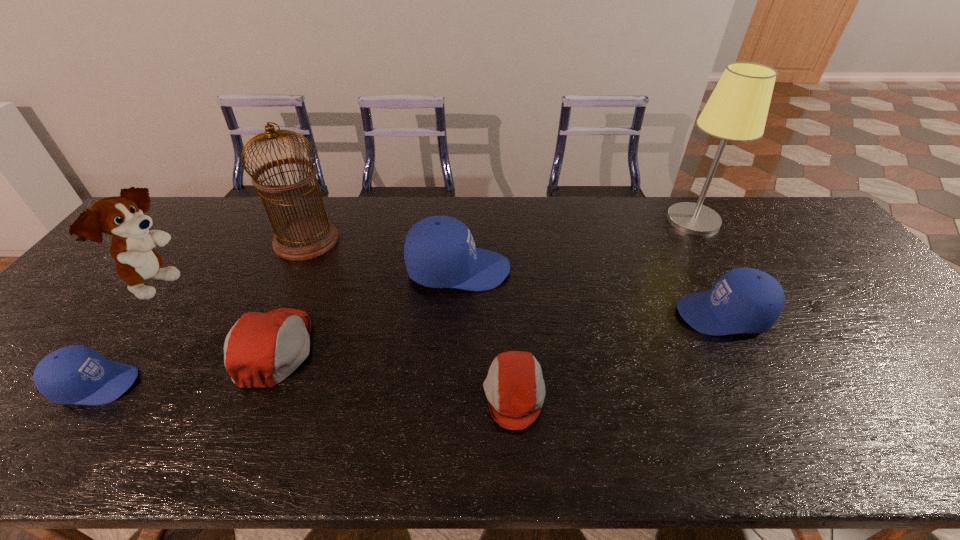
At what (x,y) coordinates should I click in order to perform the action: click on free space between the table lamp and the smallest blue cap. Please return your answer as a coordinate pair (x, y). The image size is (960, 540). Looking at the image, I should click on (395, 302).

Where is `free spot between the bigger red cap and the biggest blue cap`? The width and height of the screenshot is (960, 540). free spot between the bigger red cap and the biggest blue cap is located at coordinates (367, 309).

Locate an element on the screen. The image size is (960, 540). vacant point located between the table lamp and the second tallest object is located at coordinates (500, 230).

The image size is (960, 540). I want to click on unoccupied position between the leftmost cap and the tallest object, so click(395, 302).

Locate an element on the screen. This screenshot has height=540, width=960. the fourth closest object to the right red cap is located at coordinates (302, 238).

Identify the location of object that stands as the sixth closest to the third tallest object. Image resolution: width=960 pixels, height=540 pixels. (744, 300).

Locate an element on the screen. This screenshot has width=960, height=540. cap object that ranks as the second closest to the shortest object is located at coordinates (744, 300).

Find the location of a particular element. the second closest cap relative to the second blue cap from right to left is located at coordinates (515, 389).

Select which blue cap appears as the closest to the birdcage. Please provide its 2D coordinates. Your answer should be formatted as a tuple, i.e. [(x, y)], where the tuple contains the x and y coordinates of a point satisfying the conditions above.

[(439, 251)]

Where is `blue cap identified as the second closest to the rightmost blue cap`? Image resolution: width=960 pixels, height=540 pixels. blue cap identified as the second closest to the rightmost blue cap is located at coordinates click(76, 374).